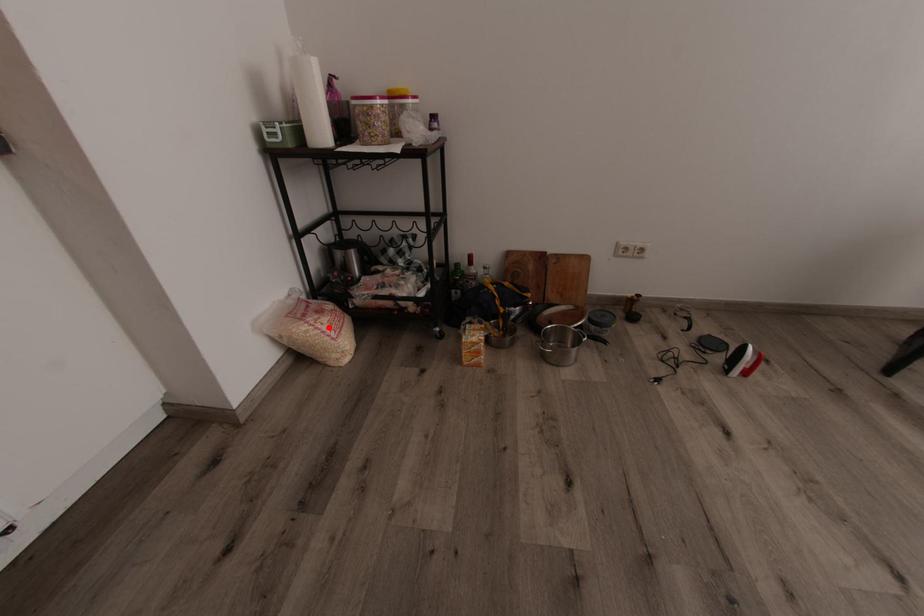
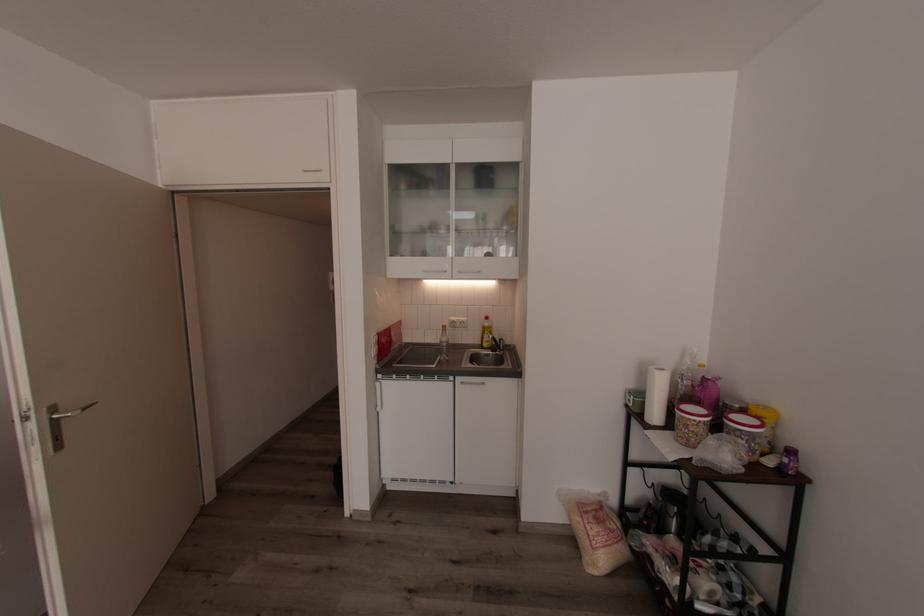
Question: I am providing you with two images of the same scene from different viewpoints. A red point is marked on the first image. Can you still see the location of the red point in image 2?

Choices:
 (A) Yes
 (B) No

Answer: (A)